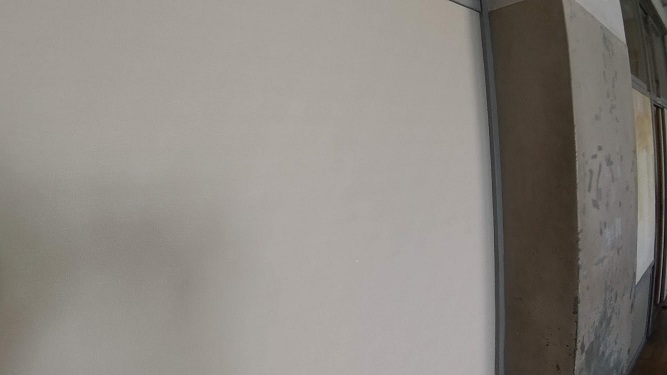
Point to all occurrences of where you would hang a poster in the image. Your answer should be formatted as a list of tuples, i.e. [(x1, y1), (x2, y2), ...], where each tuple contains the x and y coordinates of a point satisfying the conditions above.

[(253, 174)]